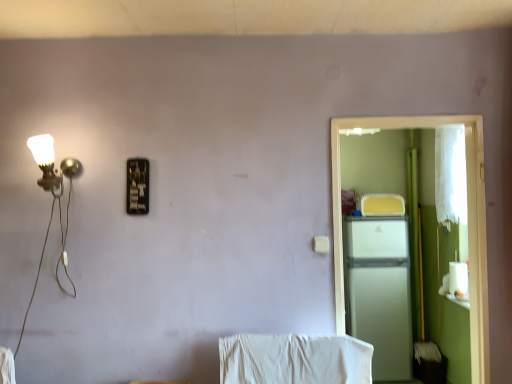
Question: Should I look upward or downward to see white matte refrigerator at right?

Choices:
 (A) down
 (B) up

Answer: (A)

Question: Is white matte refrigerator at right positioned with its back to white matte refrigerator at right?

Choices:
 (A) no
 (B) yes

Answer: (B)

Question: Is the position of white matte refrigerator at right less distant than that of white matte refrigerator at right?

Choices:
 (A) no
 (B) yes

Answer: (B)

Question: Does white matte refrigerator at right have a lesser width compared to white matte refrigerator at right?

Choices:
 (A) yes
 (B) no

Answer: (A)

Question: From the image's perspective, would you say white matte refrigerator at right is shown under white matte refrigerator at right?

Choices:
 (A) yes
 (B) no

Answer: (B)

Question: Is white matte refrigerator at right wider than white matte refrigerator at right?

Choices:
 (A) no
 (B) yes

Answer: (A)

Question: Can you confirm if white matte refrigerator at right is positioned to the left of white matte refrigerator at right?

Choices:
 (A) yes
 (B) no

Answer: (A)

Question: Is white matte refrigerator at right shorter than white matte refrigerator at right?

Choices:
 (A) yes
 (B) no

Answer: (A)

Question: Is white matte refrigerator at right at the left side of white matte refrigerator at right?

Choices:
 (A) no
 (B) yes

Answer: (A)

Question: Is white matte refrigerator at right positioned before white matte refrigerator at right?

Choices:
 (A) no
 (B) yes

Answer: (A)

Question: Is white matte refrigerator at right a part of white matte refrigerator at right?

Choices:
 (A) no
 (B) yes

Answer: (A)

Question: From the image's perspective, is white matte refrigerator at right beneath white matte refrigerator at right?

Choices:
 (A) yes
 (B) no

Answer: (A)

Question: From a real-world perspective, is white matte refrigerator at right below white matte refrigerator at right?

Choices:
 (A) yes
 (B) no

Answer: (A)

Question: In the image, is white matte refrigerator at right positioned in front of or behind white matte refrigerator at right?

Choices:
 (A) front
 (B) behind

Answer: (B)